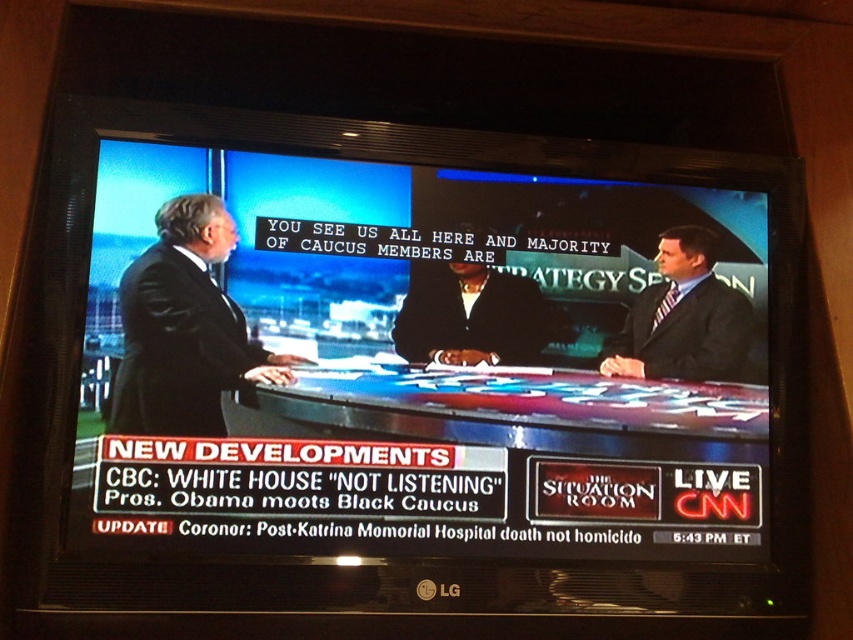
You are a camera operator adjusting the zoom to focus on both the matte black table at center and the dark suit at center. Given that the minimum distance between objects for clear focus is 5 inches, will you need to adjust the zoom to ensure both are in focus?

The distance between the matte black table at center and dark suit at center is 4.94 inches, which is less than the 5 inches required for clear focus. Therefore, you will need to adjust the zoom to ensure both are in focus.

You are watching a CNN news broadcast and see two men in suits on the screen. The black suit at left and the dark suit at center. Which one is located to the left of the other?

The black suit at left is positioned on the left side of dark suit at center.

You are a camera operator adjusting the focus on a TV screen showing a news panel discussion. You need to focus on either the point at coordinate point (273, 376) or point at coordinate point (461, 326). Which point should you choose to ensure the focus is on the closer object?

Point point (273, 376) is closer to the viewer than point point (461, 326), so you should choose point point (273, 376) to ensure the focus is on the closer object.